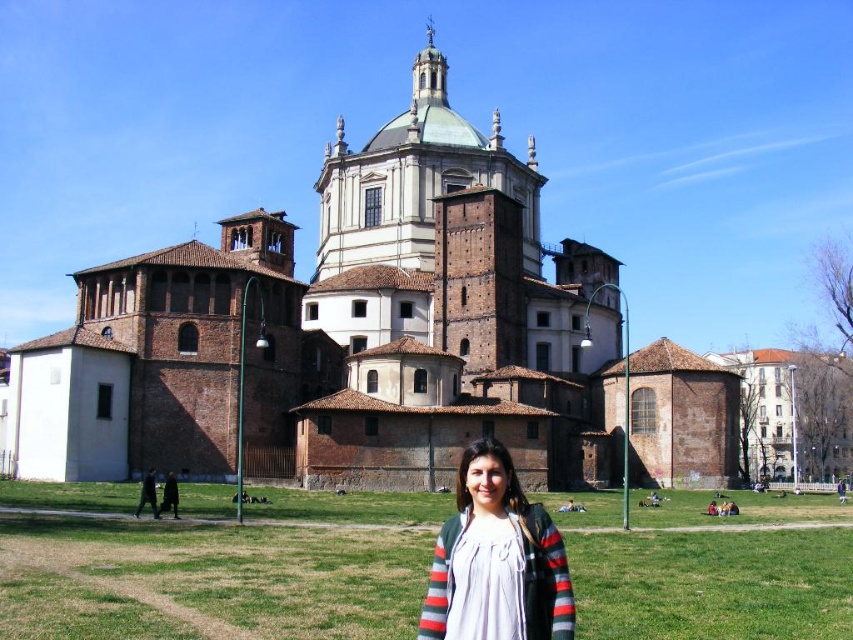
Between point (175, 436) and point (474, 490), which one is positioned in front?

Point (474, 490) is in front.

Does brown brick church at center appear over white cotton shirt at lower center?

Yes, brown brick church at center is above white cotton shirt at lower center.

Who is more distant from viewer, (505, 216) or (460, 506)?

The point (505, 216) is more distant.

The height and width of the screenshot is (640, 853). What are the coordinates of `brown brick church at center` in the screenshot? It's located at (404, 330).